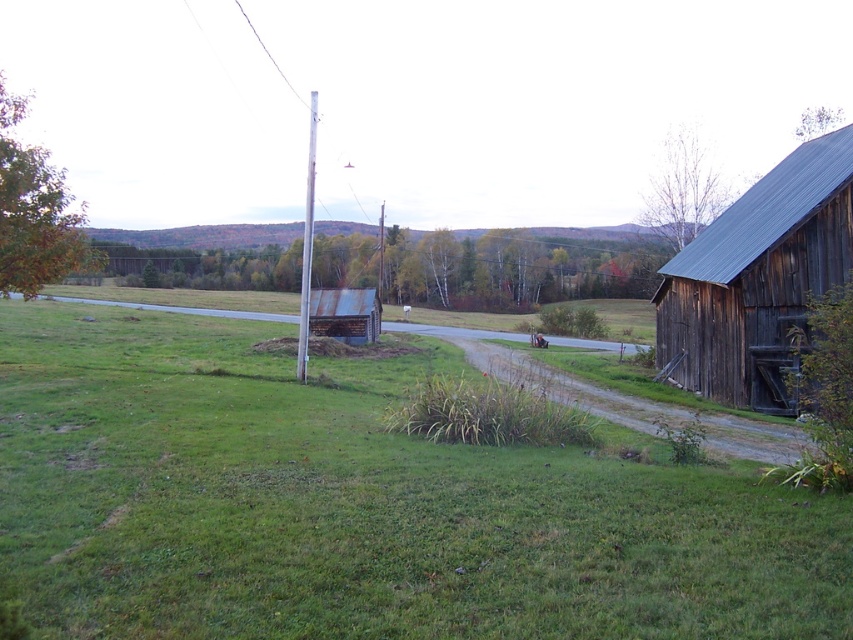
Looking at this image, you are a gardener carrying a heavy wheelbarrow full of gardening tools. You want to transport them to the dark brown wooden barn at right from the green grass at center. Considering the distance between them, is it feasible to push the wheelbarrow directly along the dirt path without making multiple trips?

The distance between the green grass at center and the dark brown wooden barn at right is 13.06 meters. Since this is a relatively short distance, it is feasible to push the wheelbarrow directly along the dirt path without needing multiple trips.

Based on the photo, you are a gardener planning to plant flowers in the green grass at center and the dark brown wooden barn at right. Which area has more space available for planting?

The dark brown wooden barn at right has more space available for planting because the green grass at center occupies less space than it.